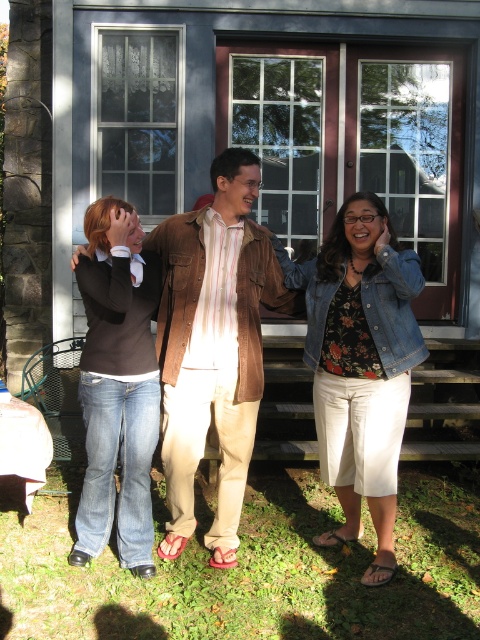
You are trying to take a photo of the brown corduroy shirt at center and the denim jeans at lower left. Which object should you focus on first to ensure both are in focus?

You should focus on the brown corduroy shirt at center first because it is closer to you than the denim jeans at lower left, so focusing on it will help ensure both are in focus.

You are standing 2 meters away from the wooden door. There is a point at coordinates point [218,387]. Can you reach this point without moving closer than 3 meters to the wooden door?

The distance of point [218,387] from camera is 3.85 meters. Since you are currently 2 meters away from the wooden door, moving to the point would require moving to 3.85 meters from the camera, which is beyond the 3 meters limit. Therefore, you cannot reach the point without moving closer than 3 meters to the wooden door.